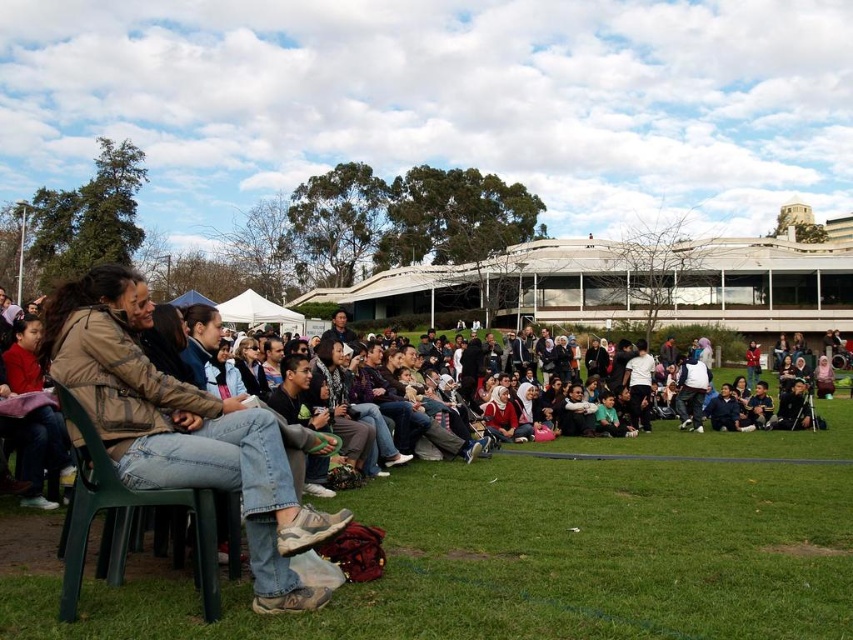
Question: Can you confirm if green grass at lower left is positioned below denim jeans at left?

Choices:
 (A) no
 (B) yes

Answer: (B)

Question: Can you confirm if green plastic chair at lower left is wider than red fleece jacket at lower left?

Choices:
 (A) yes
 (B) no

Answer: (B)

Question: Which object is positioned farthest from the red fleece jacket at lower left?

Choices:
 (A) green grass at lower left
 (B) denim jeans at left

Answer: (A)

Question: Which point is closer to the camera?

Choices:
 (A) (683, 506)
 (B) (282, 572)

Answer: (B)

Question: Is denim jeans at left positioned behind green plastic chair at lower left?

Choices:
 (A) yes
 (B) no

Answer: (B)

Question: Which is nearer to the red fleece jacket at lower left?

Choices:
 (A) denim jeans at left
 (B) green plastic chair at lower left
 (C) green grass at lower left

Answer: (A)